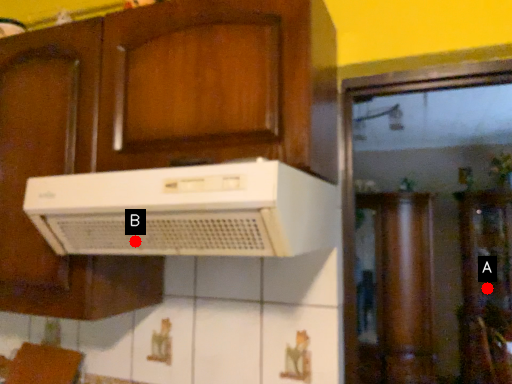
Question: Two points are circled on the image, labeled by A and B beside each circle. Which point appears closest to the camera in this image?

Choices:
 (A) A is closer
 (B) B is closer

Answer: (B)